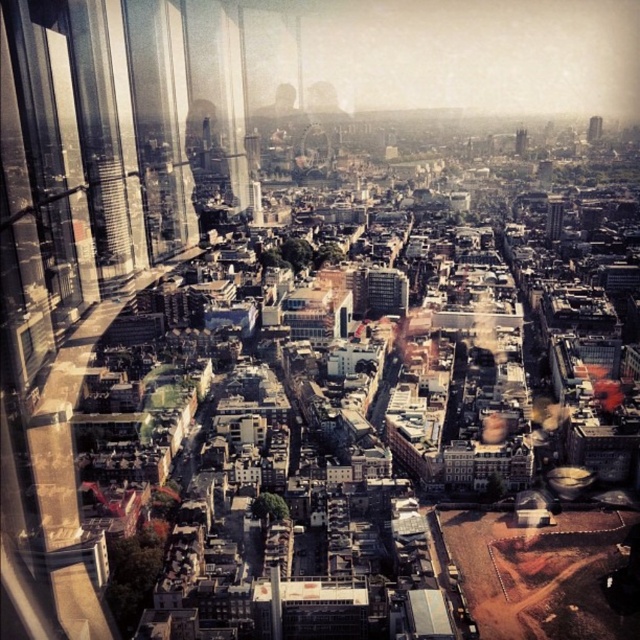
You are an architect analyzing the city skyline. You observe the smooth glass tower at center and the smooth glass tower at upper right. Which of these two towers appears taller in the image?

The smooth glass tower at center appears taller than the smooth glass tower at upper right based on their relative sizes in the image.

You are a city planner assessing the distance between two landmarks for a new public transportation route. The smooth glass tower at upper right and the dark brown stone tower at center are key points. Based on the image, can you confirm if the distance between them is sufficient to accommodate a 60 meter long elevated train platform connecting them?

The smooth glass tower at upper right and the dark brown stone tower at center are 66.37 meters apart, which is more than enough to accommodate a 60 meter long elevated train platform connecting them.